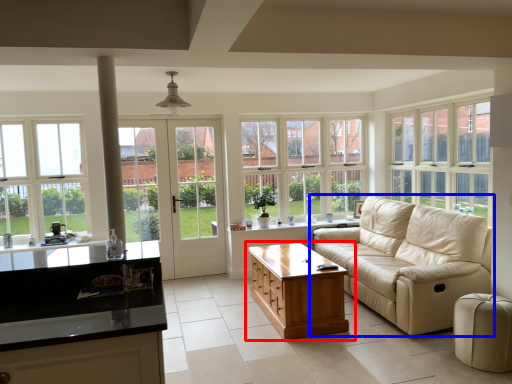
Question: Which point is closer to the camera, table (highlighted by a red box) or studio couch (highlighted by a blue box)?

Choices:
 (A) table
 (B) studio couch

Answer: (B)